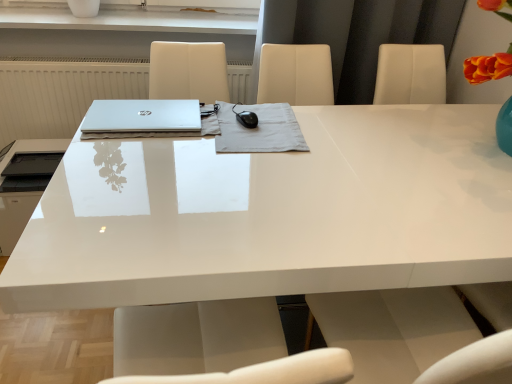
The image size is (512, 384). I want to click on free space to the left of satin black mouse at center, so (159, 142).